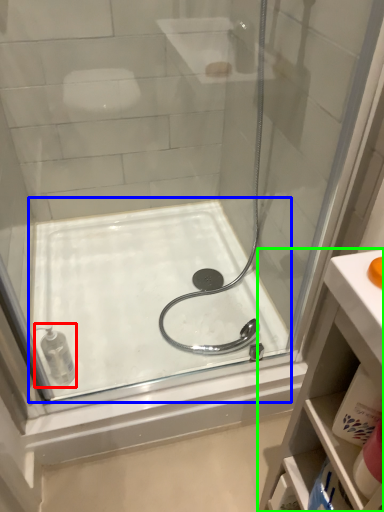
Question: Estimate the real-world distances between objects in this image. Which object is closer to toiletry (highlighted by a red box), bath (highlighted by a blue box) or bathroom cabinet (highlighted by a green box)?

Choices:
 (A) bath
 (B) bathroom cabinet

Answer: (A)